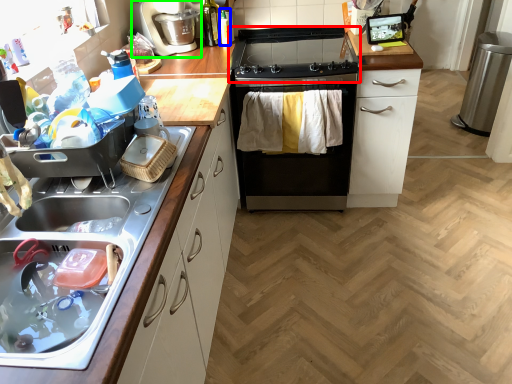
Question: Estimate the real-world distances between objects in this image. Which object is farther from gas stove (highlighted by a red box), bottle (highlighted by a blue box) or coffee machine (highlighted by a green box)?

Choices:
 (A) bottle
 (B) coffee machine

Answer: (B)